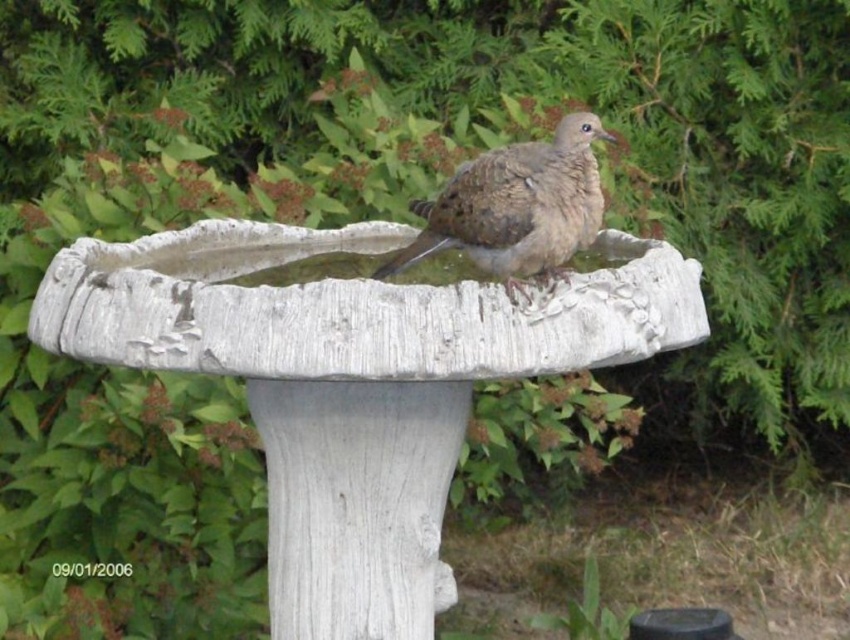
Question: Does white concrete bird bath at center appear on the left side of brown speckled bird at center?

Choices:
 (A) yes
 (B) no

Answer: (A)

Question: Is white concrete bird bath at center wider than brown speckled bird at center?

Choices:
 (A) no
 (B) yes

Answer: (B)

Question: Is white concrete bird bath at center in front of brown speckled bird at center?

Choices:
 (A) no
 (B) yes

Answer: (B)